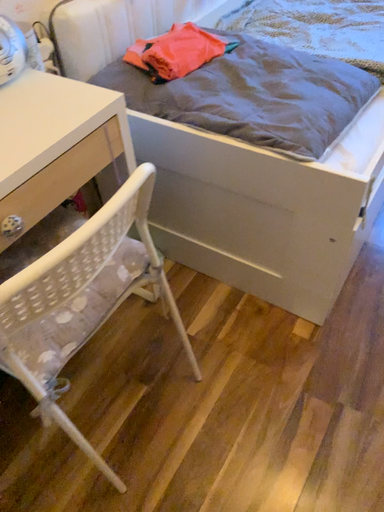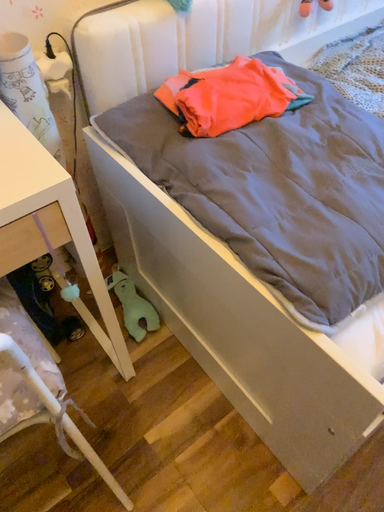
Question: Which way did the camera rotate in the video?

Choices:
 (A) rotated right
 (B) rotated left

Answer: (B)